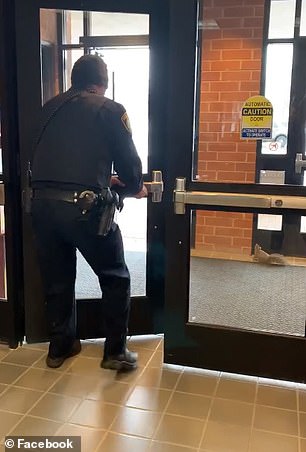
Identify the location of black cord. (61, 102).